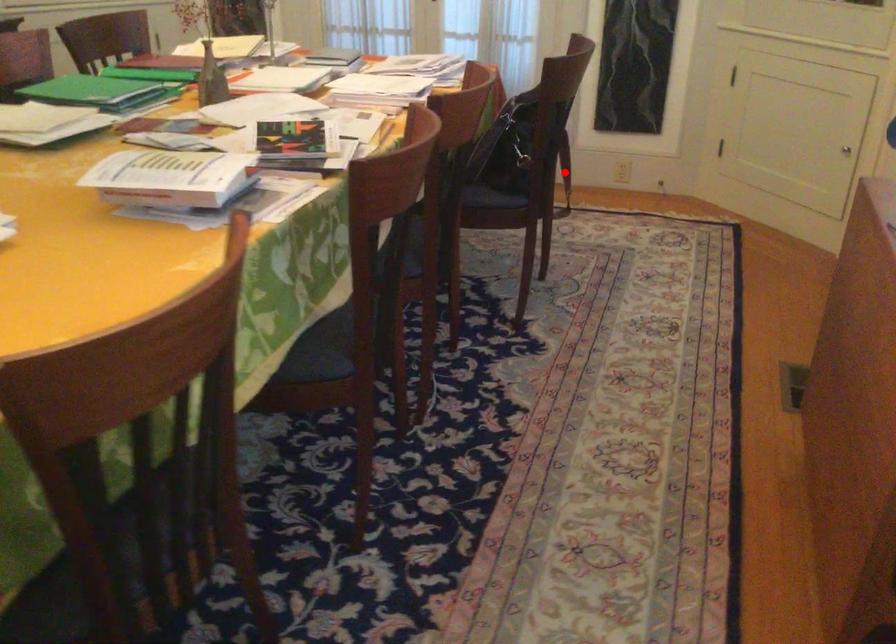
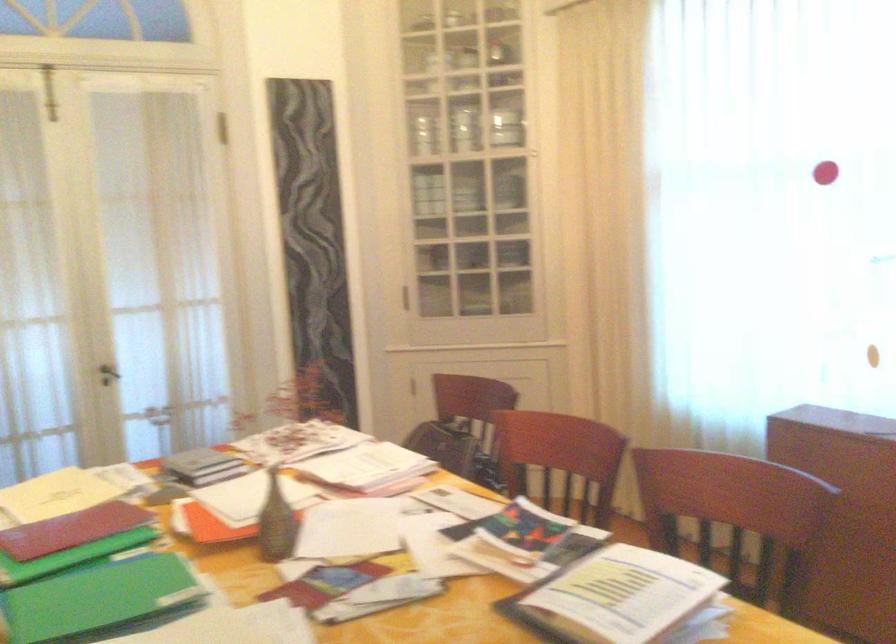
Question: I am providing you with two images of the same scene from different viewpoints. A red point is marked on the first image. At the location where the point appears in image 1, is it still visible in image 2?

Choices:
 (A) Yes
 (B) No

Answer: (B)